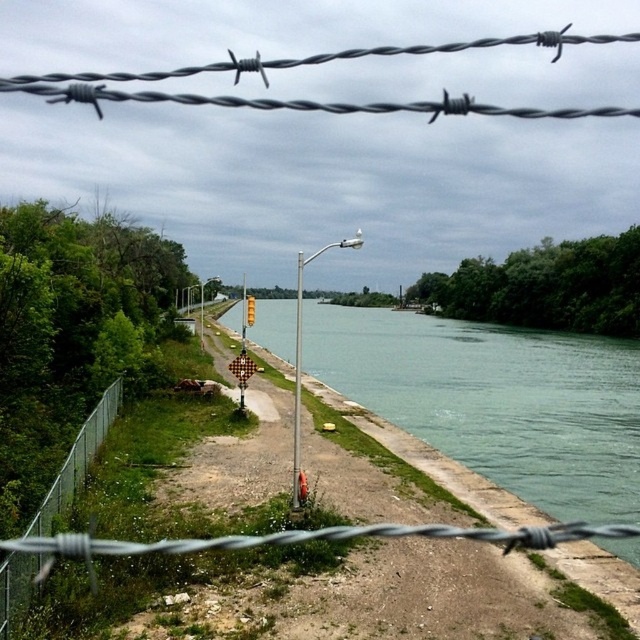
Can you confirm if green concrete river at center is thinner than green chain-link fence at lower left?

No.

Who is higher up, green concrete river at center or green chain-link fence at lower left?

green concrete river at center

The image size is (640, 640). What do you see at coordinates (497, 401) in the screenshot? I see `green concrete river at center` at bounding box center [497, 401].

The width and height of the screenshot is (640, 640). Identify the location of green concrete river at center. (497, 401).

Who is shorter, black twisted wire at upper center or barbed wire at center?

barbed wire at center

Locate an element on the screen. This screenshot has width=640, height=640. black twisted wire at upper center is located at coordinates (314, 65).

Where is `black twisted wire at upper center`? This screenshot has width=640, height=640. black twisted wire at upper center is located at coordinates (314, 65).

Between green concrete river at center and black twisted wire at upper center, which one is positioned higher?

black twisted wire at upper center is higher up.

Does green concrete river at center appear over black twisted wire at upper center?

Incorrect, green concrete river at center is not positioned above black twisted wire at upper center.

I want to click on green concrete river at center, so click(497, 401).

At what (x,y) coordinates should I click in order to perform the action: click on green concrete river at center. Please return your answer as a coordinate pair (x, y). Looking at the image, I should click on (497, 401).